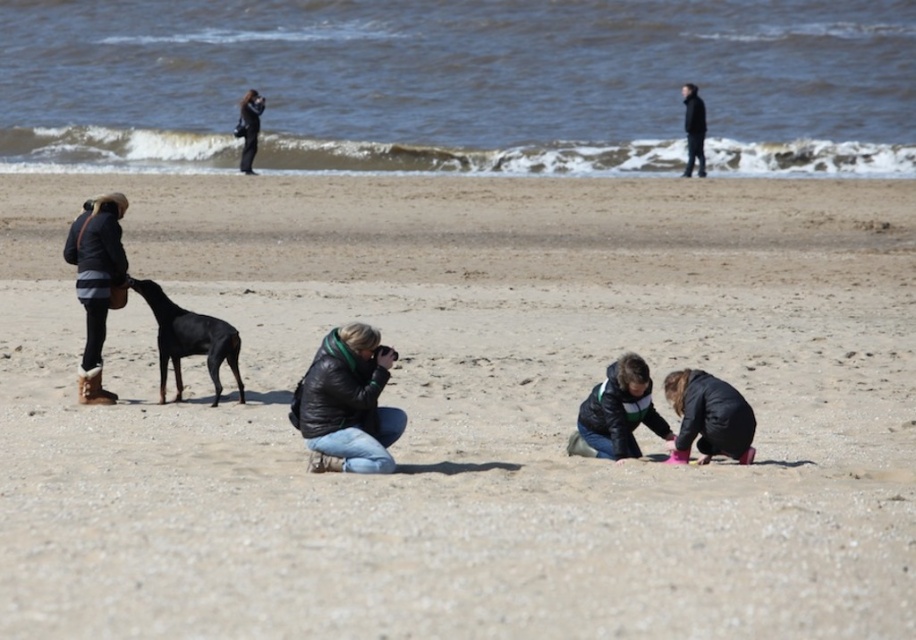
You are a photographer standing at the center of the beach scene. You want to take a photo of the black leather jacket at upper right. Which direction should you move to in order to frame it properly?

The black leather jacket at upper right is located at point (693, 129), so you should move towards the upper right direction to frame it properly.

You are a photographer at the beach scene. You need to position a tripod between the matte black jacket at lower right and the dark green jacket at upper center. Which jacket should the tripod be closer to if you want it to be placed at the same height as the shorter jacket?

The tripod should be closer to the matte black jacket at lower right because it is shorter than the dark green jacket at upper center, so positioning it near the shorter jacket ensures the tripod is at the same height as the matte black jacket at lower right.